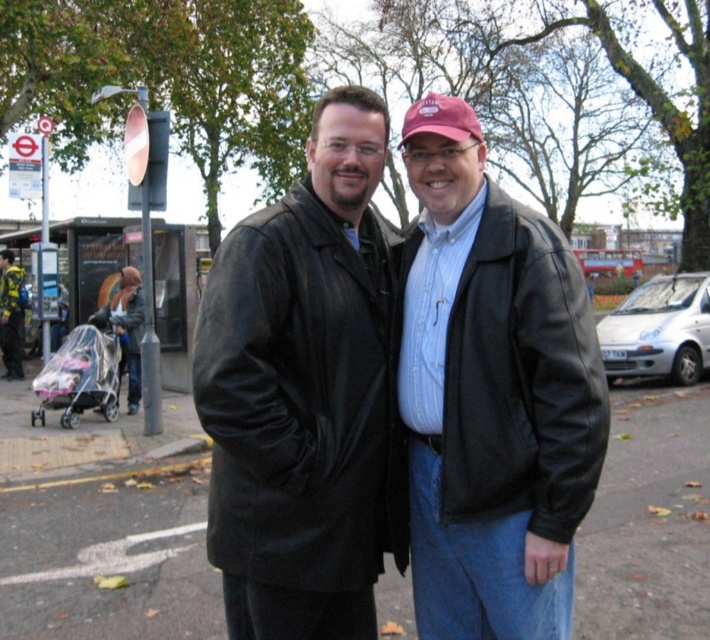
You are a photographer trying to capture a clear photo of the black leather jackets at center without the matte plastic baby carriage at left blocking the view. Based on their positions, is this possible?

The black leather jackets at center is in front of the matte plastic baby carriage at left, so taking a clear photo of the black leather jackets at center without the matte plastic baby carriage at left blocking the view is possible since the jackets are closer to the camera.

You are a delivery person carrying a package that requires a distance of at least 10 meters to safely land. You see the black leather jackets at center and the matte plastic baby carriage at left in the scene. Can you safely land the package between them?

The black leather jackets at center and the matte plastic baby carriage at left are 8.49 meters apart. Since the required distance is 10 meters, the package cannot be safely landed between them as the distance is insufficient.